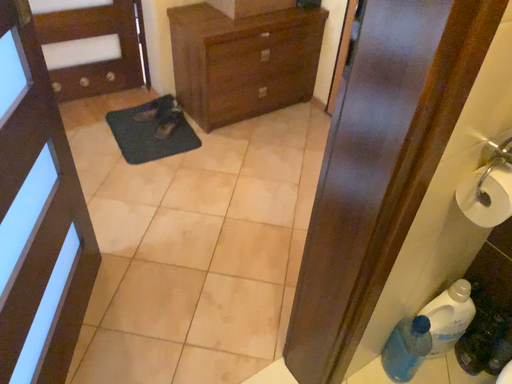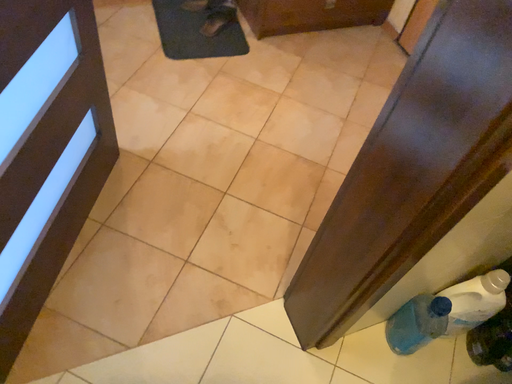
Question: How did the camera likely rotate when shooting the video?

Choices:
 (A) rotated downward
 (B) rotated upward

Answer: (A)